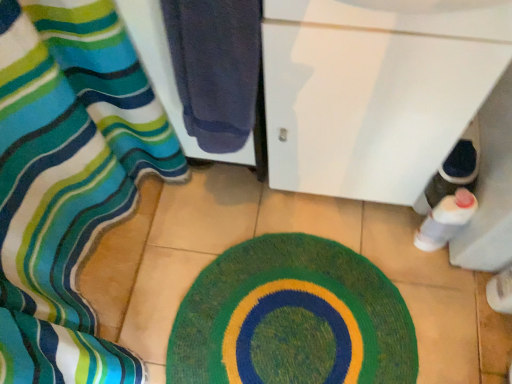
Question: Can you confirm if white glossy cabinet at lower right is thinner than dark blue towel at left?

Choices:
 (A) yes
 (B) no

Answer: (B)

Question: From a real-world perspective, is white glossy cabinet at lower right on top of dark blue towel at left?

Choices:
 (A) no
 (B) yes

Answer: (A)

Question: Would you say dark blue towel at left is part of white glossy cabinet at lower right's contents?

Choices:
 (A) yes
 (B) no

Answer: (B)

Question: Could you tell me if white glossy cabinet at lower right is facing dark blue towel at left?

Choices:
 (A) no
 (B) yes

Answer: (A)

Question: Is white glossy cabinet at lower right next to dark blue towel at left?

Choices:
 (A) no
 (B) yes

Answer: (A)

Question: Is white glossy cabinet at lower right shorter than dark blue towel at left?

Choices:
 (A) yes
 (B) no

Answer: (B)

Question: Does white glossy cabinet at lower right turn towards silky striped fabric at left?

Choices:
 (A) no
 (B) yes

Answer: (A)

Question: Is white glossy cabinet at lower right looking in the opposite direction of silky striped fabric at left?

Choices:
 (A) no
 (B) yes

Answer: (A)

Question: Does white glossy cabinet at lower right lie in front of silky striped fabric at left?

Choices:
 (A) yes
 (B) no

Answer: (A)

Question: Is white glossy cabinet at lower right completely or partially outside of silky striped fabric at left?

Choices:
 (A) yes
 (B) no

Answer: (A)

Question: Does white glossy cabinet at lower right have a lesser height compared to silky striped fabric at left?

Choices:
 (A) no
 (B) yes

Answer: (A)

Question: Is white glossy cabinet at lower right at the left side of silky striped fabric at left?

Choices:
 (A) yes
 (B) no

Answer: (B)

Question: Is the depth of silky striped fabric at left greater than that of green knitted bath mat at center?

Choices:
 (A) no
 (B) yes

Answer: (B)